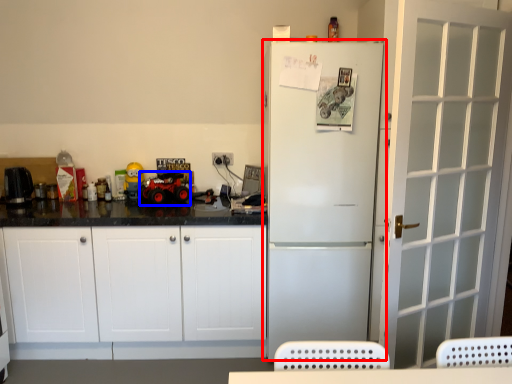
Question: Which point is further to the camera, refrigerator (highlighted by a red box) or toy car (highlighted by a blue box)?

Choices:
 (A) refrigerator
 (B) toy car

Answer: (B)